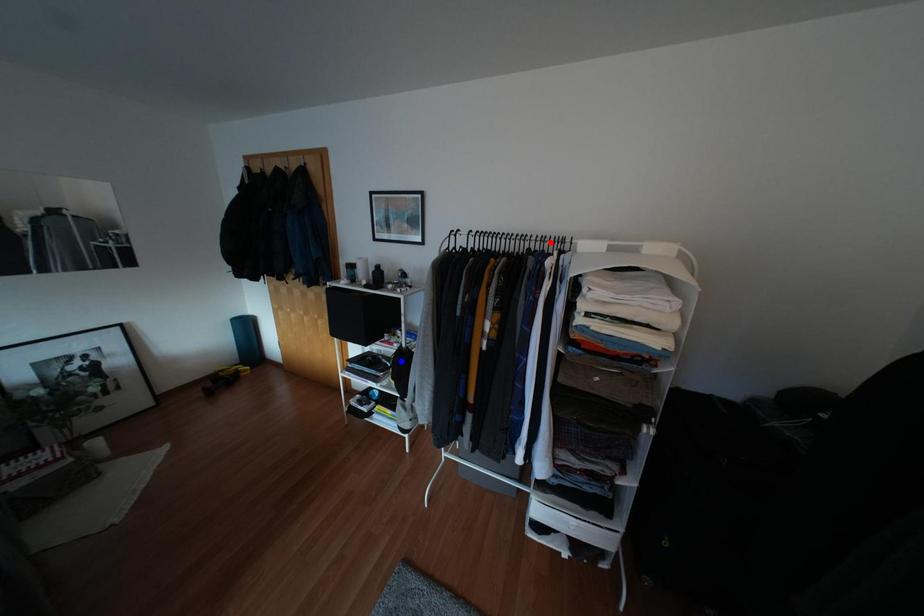
Question: In the image, two points are highlighted. Which point is nearer to the camera? Reply with the corresponding letter.

Choices:
 (A) blue point
 (B) red point

Answer: (B)